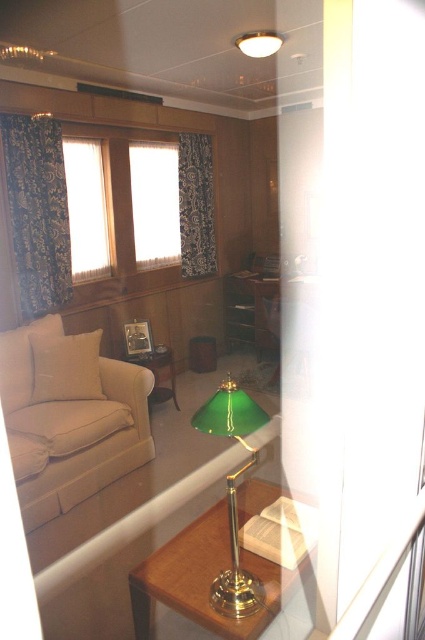
You are standing in the room and want to hang a picture frame between the white lace curtain at upper center and the green glass lampshade at upper center. Which object should the frame be placed above?

The picture frame should be placed above the white lace curtain at upper center because the green glass lampshade at upper center is above it.

You are planning to hang a decorative banner that is 1 meter wide. You notice the white sheer curtain at upper left and the green glass lampshade at upper center. Which object has enough space to accommodate the banner without overlapping?

The green glass lampshade at upper center has a greater width than the white sheer curtain at upper left, so it can accommodate the 1 meter wide banner without overlapping.

You are standing in the living room and want to hang a picture frame between the white sheer curtain at upper left and the green glass lampshade at upper center. Considering their heights, which object should the frame be placed closer to in order to maintain visual balance?

The white sheer curtain at upper left has a greater height compared to the green glass lampshade at upper center, so to maintain visual balance, the picture frame should be placed closer to the green glass lampshade at upper center.